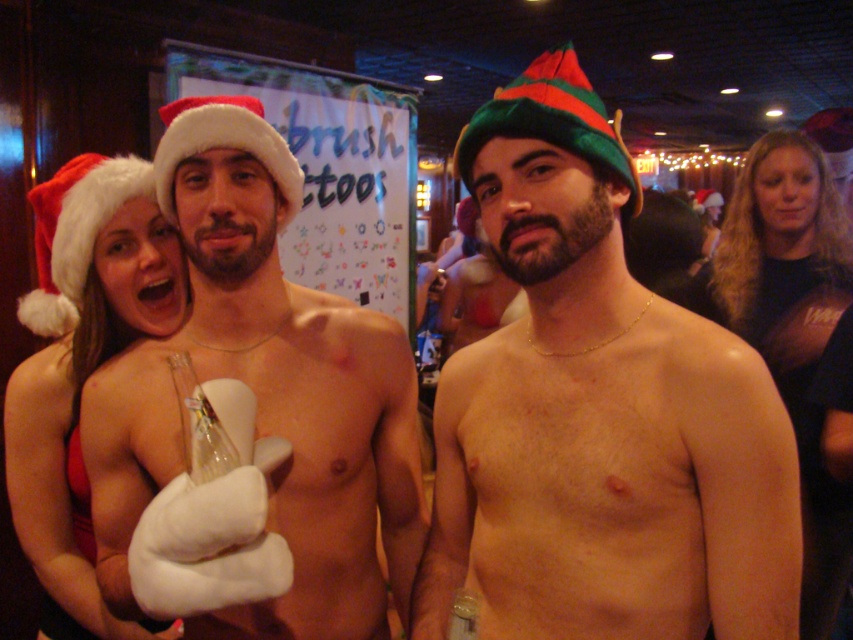
Question: Is white fluffy glove at center closer to the viewer compared to green felt christmas hat at center?

Choices:
 (A) no
 (B) yes

Answer: (B)

Question: Among these objects, which one is farthest from the camera?

Choices:
 (A) black matte shirt at upper right
 (B) shiny metallic hat at center
 (C) matte red santa hat at left

Answer: (A)

Question: Estimate the real-world distances between objects in this image. Which object is closer to the black matte shirt at upper right?

Choices:
 (A) shiny metallic hat at center
 (B) white fluffy glove at center
 (C) white fluffy santa hat at upper left
 (D) green felt christmas hat at center

Answer: (A)

Question: Does black matte shirt at upper right appear on the right side of white fluffy santa hat at upper left?

Choices:
 (A) no
 (B) yes

Answer: (B)

Question: Does matte red santa hat at left have a smaller size compared to black matte shirt at upper right?

Choices:
 (A) no
 (B) yes

Answer: (B)

Question: Which object is the closest to the matte red santa hat at left?

Choices:
 (A) shiny metallic hat at center
 (B) white fluffy santa hat at upper left
 (C) green felt christmas hat at center

Answer: (B)